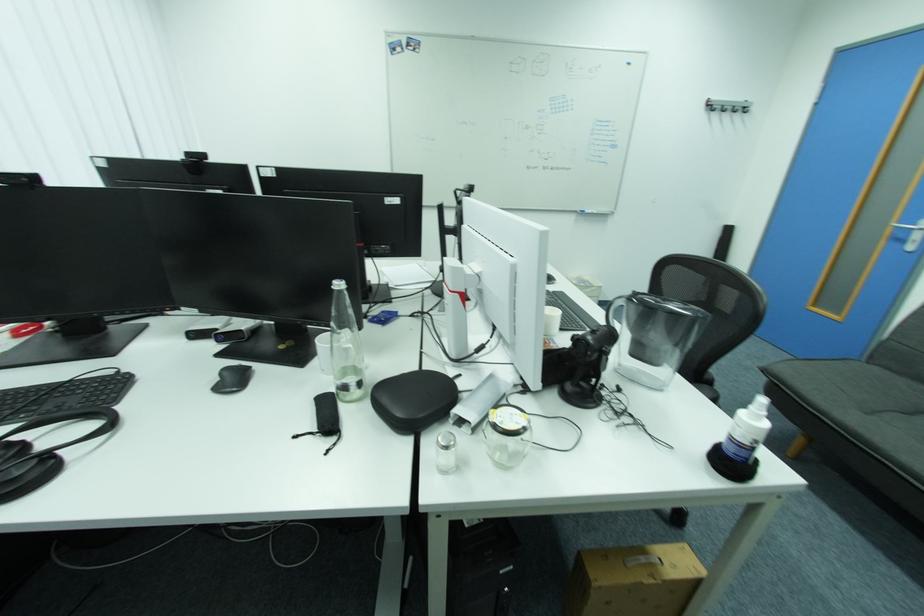
At what (x,y) coordinates should I click in order to perform the action: click on white ceramic mug. Please return your answer as a coordinate pair (x, y). This screenshot has height=616, width=924. Looking at the image, I should click on (551, 321).